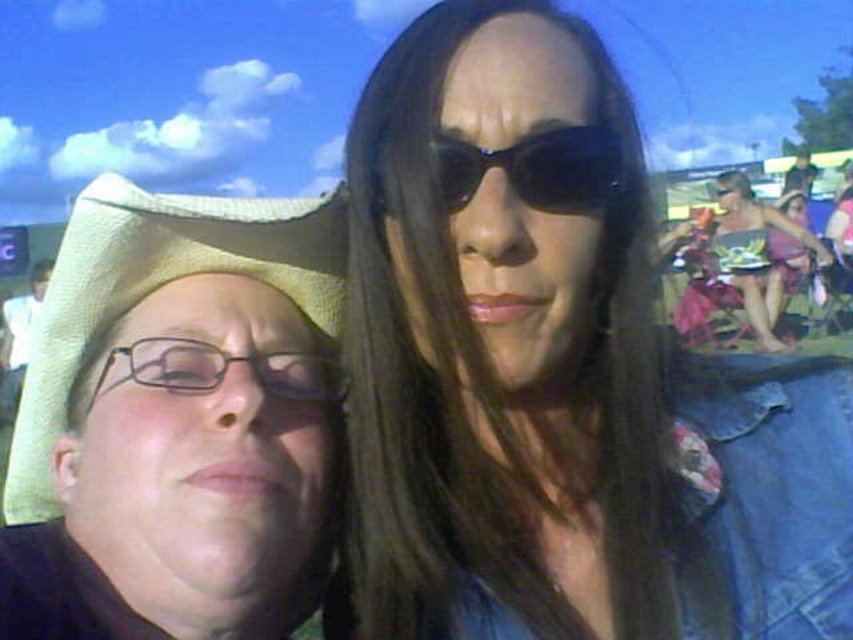
Question: Which point is farther to the camera?

Choices:
 (A) (x=505, y=556)
 (B) (x=24, y=404)

Answer: (B)

Question: Which point appears farthest from the camera in this image?

Choices:
 (A) (328, 380)
 (B) (756, 336)
 (C) (190, 202)
 (D) (566, 129)

Answer: (B)

Question: Which point is closer to the camera?

Choices:
 (A) clear plastic glasses at center
 (B) patterned fabric bikini top at right
 (C) shiny black sunglasses at center
 (D) black shiny sunglasses at center

Answer: (C)

Question: Is clear plastic glasses at center smaller than patterned fabric bikini top at right?

Choices:
 (A) no
 (B) yes

Answer: (B)

Question: Is the position of shiny black sunglasses at center less distant than that of clear plastic glasses at center?

Choices:
 (A) no
 (B) yes

Answer: (B)

Question: Considering the relative positions of yellow straw hat at left and patterned fabric bikini top at right in the image provided, where is yellow straw hat at left located with respect to patterned fabric bikini top at right?

Choices:
 (A) above
 (B) below

Answer: (B)